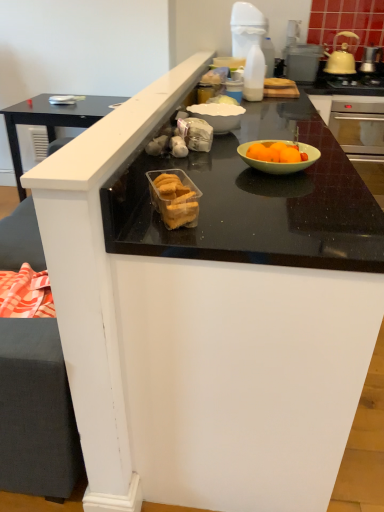
Question: Is yellow ceramic kettle at upper right a part of translucent plastic container of cookies at center?

Choices:
 (A) no
 (B) yes

Answer: (A)

Question: From a real-world perspective, is translucent plastic container of cookies at center positioned under yellow ceramic kettle at upper right based on gravity?

Choices:
 (A) no
 (B) yes

Answer: (B)

Question: Is translucent plastic container of cookies at center closer to the viewer compared to yellow ceramic kettle at upper right?

Choices:
 (A) yes
 (B) no

Answer: (A)

Question: Is the depth of translucent plastic container of cookies at center greater than that of yellow ceramic kettle at upper right?

Choices:
 (A) yes
 (B) no

Answer: (B)

Question: Considering the relative sizes of translucent plastic container of cookies at center and yellow ceramic kettle at upper right in the image provided, is translucent plastic container of cookies at center shorter than yellow ceramic kettle at upper right?

Choices:
 (A) no
 (B) yes

Answer: (B)

Question: Looking at the image, does translucent plastic container of cookies at center seem bigger or smaller compared to black glass gas stove at upper right?

Choices:
 (A) big
 (B) small

Answer: (B)

Question: From a real-world perspective, relative to black glass gas stove at upper right, is translucent plastic container of cookies at center vertically above or below?

Choices:
 (A) above
 (B) below

Answer: (A)

Question: Considering the positions of point (187, 179) and point (370, 74), is point (187, 179) closer or farther from the camera than point (370, 74)?

Choices:
 (A) closer
 (B) farther

Answer: (A)

Question: From their relative heights in the image, would you say translucent plastic container of cookies at center is taller or shorter than black glass gas stove at upper right?

Choices:
 (A) tall
 (B) short

Answer: (A)

Question: Considering the relative positions of metallic silver toaster at upper right and black glass gas stove at upper right in the image provided, is metallic silver toaster at upper right to the left or to the right of black glass gas stove at upper right?

Choices:
 (A) left
 (B) right

Answer: (A)

Question: Is metallic silver toaster at upper right bigger or smaller than black glass gas stove at upper right?

Choices:
 (A) big
 (B) small

Answer: (B)

Question: Relative to black glass gas stove at upper right, is metallic silver toaster at upper right in front or behind?

Choices:
 (A) behind
 (B) front

Answer: (A)

Question: Choose the correct answer: Is metallic silver toaster at upper right inside black glass gas stove at upper right or outside it?

Choices:
 (A) inside
 (B) outside

Answer: (B)

Question: Considering the positions of yellow ceramic kettle at upper right and black glass gas stove at upper right in the image, is yellow ceramic kettle at upper right taller or shorter than black glass gas stove at upper right?

Choices:
 (A) short
 (B) tall

Answer: (B)

Question: Considering the positions of point (332, 58) and point (375, 84), is point (332, 58) closer or farther from the camera than point (375, 84)?

Choices:
 (A) closer
 (B) farther

Answer: (B)